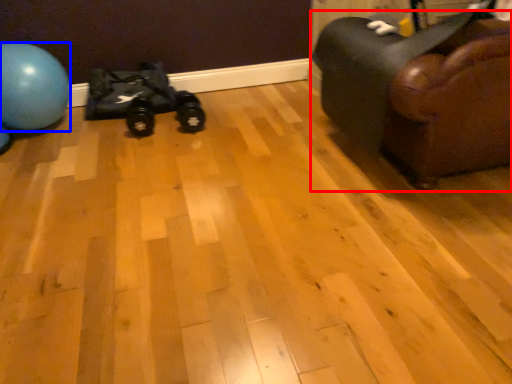
Question: Which point is further to the camera, furniture (highlighted by a red box) or ball (highlighted by a blue box)?

Choices:
 (A) furniture
 (B) ball

Answer: (B)